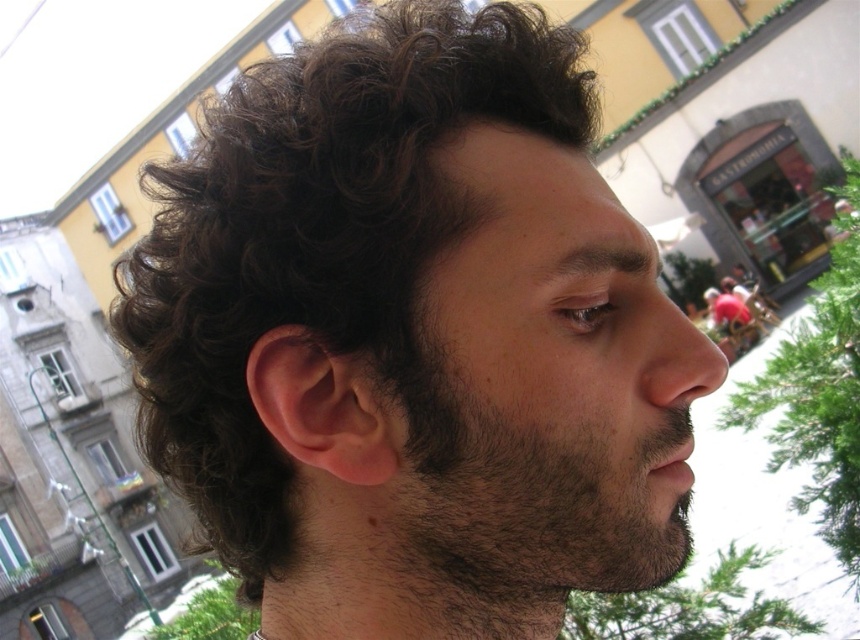
You are an artist sketching this person. You need to decide which feature to draw first based on their size. Which one should you start with, the dark brown curly hair at center or the brown hairy mouth at lower center?

The dark brown curly hair at center is larger in size than the brown hairy mouth at lower center, so you should start with the dark brown curly hair at center first.

You are a photographer adjusting the focus on your camera. You need to ensure that both the dark brown curly hair at center and the dark brown fuzzy beard at center are in focus. Given their widths, which object requires a wider depth of field to capture clearly?

The dark brown curly hair at center has a larger width than the dark brown fuzzy beard at center. To capture both in focus, the wider depth of field should be applied to the dark brown curly hair at center since it is wider.

Consider the image. You are a photographer adjusting your lens to focus on the person in the image. You notice two features on their face. Which one would appear larger in your viewfinder when focusing on the dark brown fuzzy beard at center and the brown hairy mouth at lower center?

The dark brown fuzzy beard at center appears larger in the viewfinder because it is larger in size than the brown hairy mouth at lower center.